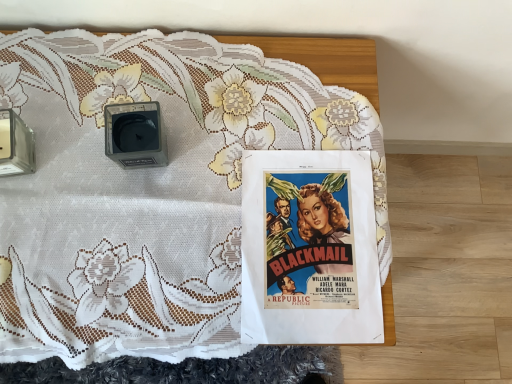
The image size is (512, 384). I want to click on matte black alarm clock at upper left, so coord(135,134).

In the scene shown: Looking at the image, does white lace tablecloth at center seem bigger or smaller compared to matte black alarm clock at upper left?

In the image, white lace tablecloth at center appears to be larger than matte black alarm clock at upper left.

How far apart are white lace tablecloth at center and matte black alarm clock at upper left?

6.00 inches.

Does point (14, 36) come farther from viewer compared to point (154, 126)?

Yes, point (14, 36) is behind point (154, 126).

Based on the photo, is white lace tablecloth at center positioned with its back to matte black alarm clock at upper left?

No, white lace tablecloth at center is not facing the opposite direction of matte black alarm clock at upper left.

Between matte black alarm clock at upper left and white lace tablecloth at center, which one has smaller width?

matte black alarm clock at upper left.

Between matte black alarm clock at upper left and white lace tablecloth at center, which one appears on the left side from the viewer's perspective?

matte black alarm clock at upper left.

Is matte black alarm clock at upper left aimed at white lace tablecloth at center?

No, matte black alarm clock at upper left is not oriented towards white lace tablecloth at center.

Does matte black alarm clock at upper left lie in front of white lace tablecloth at center?

No, it is behind white lace tablecloth at center.

Based on the photo, is vivid paper poster at center positioned with its back to matte black alarm clock at upper left?

No, vivid paper poster at center is not facing the opposite direction of matte black alarm clock at upper left.

Based on the photo, which of these two, vivid paper poster at center or matte black alarm clock at upper left, stands taller?

Standing taller between the two is matte black alarm clock at upper left.

Is vivid paper poster at center positioned behind matte black alarm clock at upper left?

Yes, it is behind matte black alarm clock at upper left.

Between vivid paper poster at center and matte black alarm clock at upper left, which one has larger width?

vivid paper poster at center.

Considering the sizes of objects vivid paper poster at center and white lace tablecloth at center in the image provided, who is bigger, vivid paper poster at center or white lace tablecloth at center?

With larger size is white lace tablecloth at center.

Consider the image. Are vivid paper poster at center and white lace tablecloth at center located far from each other?

vivid paper poster at center is near white lace tablecloth at center, not far away.

Is vivid paper poster at center inside the boundaries of white lace tablecloth at center, or outside?

vivid paper poster at center is inside white lace tablecloth at center.

In the scene shown: Can you tell me how much white lace tablecloth at center and vivid paper poster at center differ in facing direction?

The angular difference between white lace tablecloth at center and vivid paper poster at center is 1.98 degrees.

Does white lace tablecloth at center contain vivid paper poster at center?

Absolutely, vivid paper poster at center is inside white lace tablecloth at center.

Looking at this image, from the image's perspective, between white lace tablecloth at center and vivid paper poster at center, who is located below?

From the image's view, vivid paper poster at center is below.

Looking at this image, is white lace tablecloth at center wider than vivid paper poster at center?

Correct, the width of white lace tablecloth at center exceeds that of vivid paper poster at center.

From the image's perspective, between matte black alarm clock at upper left and vivid paper poster at center, who is located below?

vivid paper poster at center, from the image's perspective.

Is matte black alarm clock at upper left wider than vivid paper poster at center?

In fact, matte black alarm clock at upper left might be narrower than vivid paper poster at center.

How distant is matte black alarm clock at upper left from vivid paper poster at center?

10.06 inches.

Locate an element on the screen. This screenshot has height=384, width=512. bed below the matte black alarm clock at upper left (from the image's perspective) is located at coordinates 156,185.

Image resolution: width=512 pixels, height=384 pixels. In order to click on alarm above the white lace tablecloth at center (from a real-world perspective) in this screenshot , I will do `click(135, 134)`.

Considering their positions, is white lace tablecloth at center positioned further to matte black alarm clock at upper left than vivid paper poster at center?

vivid paper poster at center is positioned further to the anchor matte black alarm clock at upper left.

Looking at the image, which one is located further to white lace tablecloth at center, matte black alarm clock at upper left or vivid paper poster at center?

Based on the image, matte black alarm clock at upper left appears to be further to white lace tablecloth at center.

Estimate the real-world distances between objects in this image. Which object is further from matte black alarm clock at upper left, vivid paper poster at center or white lace tablecloth at center?

vivid paper poster at center lies further to matte black alarm clock at upper left than the other object.

Based on their spatial positions, is vivid paper poster at center or matte black alarm clock at upper left closer to white lace tablecloth at center?

Among the two, vivid paper poster at center is located nearer to white lace tablecloth at center.

Estimate the real-world distances between objects in this image. Which object is further from vivid paper poster at center, matte black alarm clock at upper left or white lace tablecloth at center?

matte black alarm clock at upper left is positioned further to the anchor vivid paper poster at center.

Which object lies further to the anchor point vivid paper poster at center, white lace tablecloth at center or matte black alarm clock at upper left?

matte black alarm clock at upper left.

This screenshot has width=512, height=384. I want to click on bed situated between matte black alarm clock at upper left and vivid paper poster at center from left to right, so (156, 185).